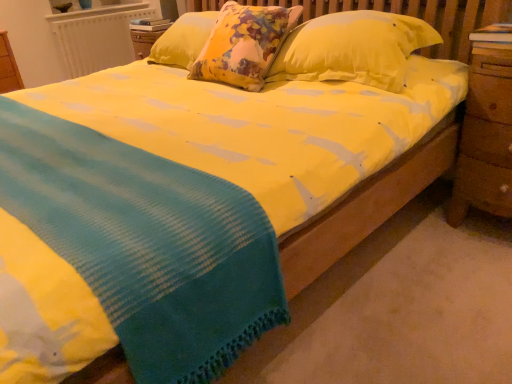
Question: Is white textured radiator at upper left thinner than wooden at right?

Choices:
 (A) no
 (B) yes

Answer: (B)

Question: Is white textured radiator at upper left not near wooden at right?

Choices:
 (A) no
 (B) yes

Answer: (B)

Question: Does white textured radiator at upper left have a greater height compared to wooden at right?

Choices:
 (A) yes
 (B) no

Answer: (B)

Question: Could you tell me if white textured radiator at upper left is facing wooden at right?

Choices:
 (A) yes
 (B) no

Answer: (A)

Question: Considering the relative sizes of white textured radiator at upper left and wooden at right in the image provided, is white textured radiator at upper left shorter than wooden at right?

Choices:
 (A) no
 (B) yes

Answer: (B)

Question: From the image's perspective, would you say white textured radiator at upper left is positioned over wooden at right?

Choices:
 (A) yes
 (B) no

Answer: (A)

Question: Is yellow fabric pillow at center at the left side of wooden at right?

Choices:
 (A) no
 (B) yes

Answer: (B)

Question: From the image's perspective, does yellow fabric pillow at center appear lower than wooden at right?

Choices:
 (A) yes
 (B) no

Answer: (B)

Question: From a real-world perspective, is yellow fabric pillow at center over wooden at right?

Choices:
 (A) yes
 (B) no

Answer: (A)

Question: Are yellow fabric pillow at center and wooden at right making contact?

Choices:
 (A) no
 (B) yes

Answer: (A)

Question: Is wooden at right surrounded by yellow fabric pillow at center?

Choices:
 (A) no
 (B) yes

Answer: (A)

Question: From the image's perspective, is yellow fabric pillow at center on wooden at right?

Choices:
 (A) no
 (B) yes

Answer: (B)

Question: From a real-world perspective, is yellow cotton blanket at center physically above yellow fabric pillow at center?

Choices:
 (A) yes
 (B) no

Answer: (B)